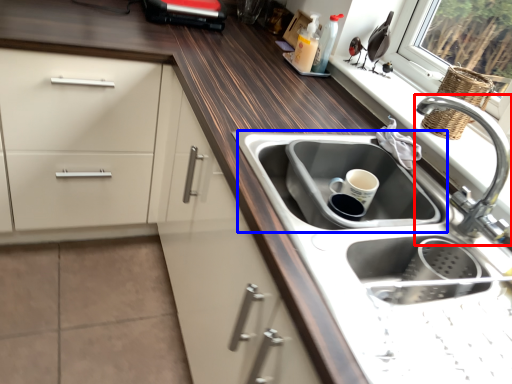
Question: Which of the following is the farthest to the observer, tap (highlighted by a red box) or sink (highlighted by a blue box)?

Choices:
 (A) tap
 (B) sink

Answer: (B)